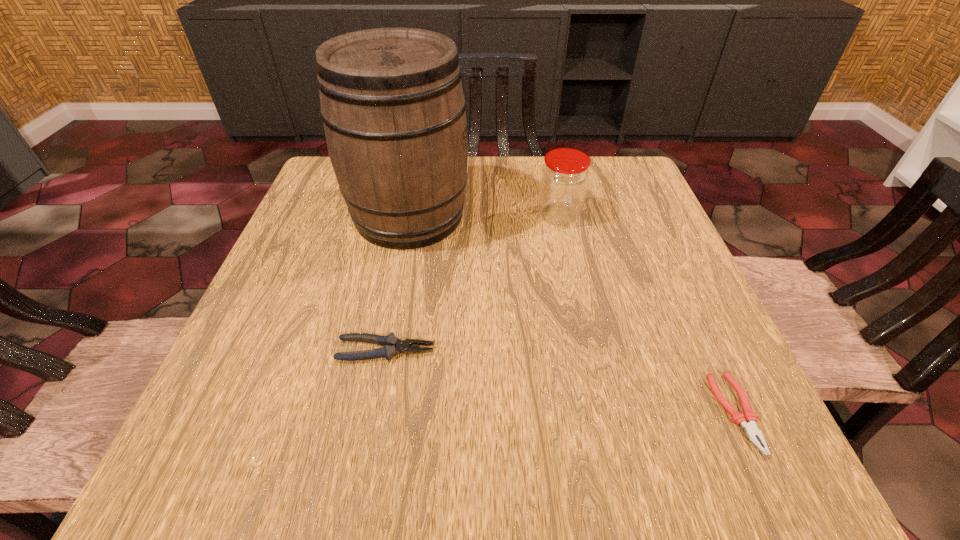
This screenshot has width=960, height=540. I want to click on the tallest object, so point(392,104).

Locate an element on the screen. The height and width of the screenshot is (540, 960). jar is located at coordinates (564, 179).

The width and height of the screenshot is (960, 540). I want to click on the third shortest object, so click(x=564, y=179).

Where is `the left pliers`? This screenshot has width=960, height=540. the left pliers is located at coordinates (392, 345).

You are a GUI agent. You are given a task and a screenshot of the screen. Output one action in this format:
    pyautogui.click(x=<x>, y=<y>)
    Task: Click on the third tallest object
    This screenshot has height=540, width=960.
    Given the screenshot: What is the action you would take?
    pyautogui.click(x=392, y=345)

The image size is (960, 540). Identify the location of the right pliers. (747, 420).

This screenshot has width=960, height=540. Find the location of `the shorter pliers`. the shorter pliers is located at coordinates (747, 420).

At what (x,y) coordinates should I click in order to perform the action: click on free space located on the right of the wine bucket. Please return your answer as a coordinate pair (x, y). The width and height of the screenshot is (960, 540). Looking at the image, I should click on (588, 215).

Where is `vacant space located 0.130m on the left of the third object from left to right`? vacant space located 0.130m on the left of the third object from left to right is located at coordinates (480, 216).

I want to click on free space located 0.060m at the gripping part of the left pliers, so click(x=470, y=350).